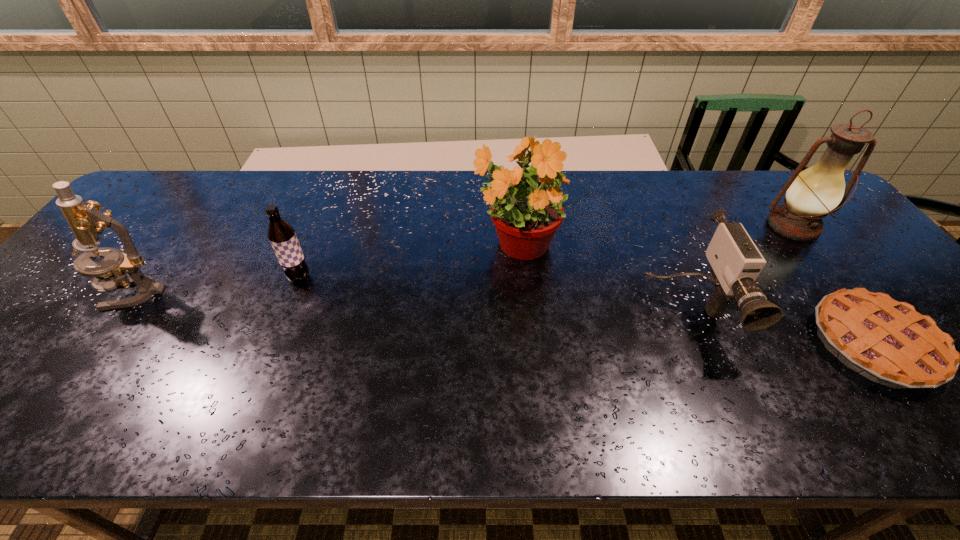
In order to click on free area in between the leftmost object and the camcorder in this screenshot , I will do `click(412, 302)`.

At what (x,y) coordinates should I click in order to perform the action: click on blank region between the oil lamp and the flowerpot. Please return your answer as a coordinate pair (x, y). The height and width of the screenshot is (540, 960). Looking at the image, I should click on (655, 237).

Where is `free space between the leftmost object and the root beer`? free space between the leftmost object and the root beer is located at coordinates (218, 285).

Find the location of a particular element. The width and height of the screenshot is (960, 540). free point between the oil lamp and the flowerpot is located at coordinates (655, 237).

At what (x,y) coordinates should I click in order to perform the action: click on free area in between the microscope and the third object from right to left. Please return your answer as a coordinate pair (x, y). The height and width of the screenshot is (540, 960). Looking at the image, I should click on (412, 302).

This screenshot has height=540, width=960. In order to click on free area in between the root beer and the third object from left to right in this screenshot , I will do `click(407, 262)`.

Point out which object is positioned as the second nearest to the shortest object. Please provide its 2D coordinates. Your answer should be formatted as a tuple, i.e. [(x, y)], where the tuple contains the x and y coordinates of a point satisfying the conditions above.

[(811, 194)]

Select which object is the fourth closest to the flowerpot. Please provide its 2D coordinates. Your answer should be formatted as a tuple, i.e. [(x, y)], where the tuple contains the x and y coordinates of a point satisfying the conditions above.

[(811, 194)]

Identify the location of free spot that satisfies the following two spatial constraints: 1. on the back side of the second object from left to right; 2. on the left side of the oil lamp. (319, 227).

Identify the location of free space that satisfies the following two spatial constraints: 1. on the back side of the leftmost object; 2. on the right side of the oil lamp. (183, 227).